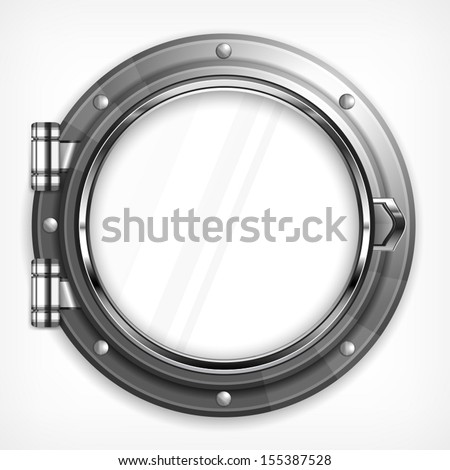
Where is `gray opening knobs`? The image size is (450, 470). gray opening knobs is located at coordinates (51, 146), (52, 301).